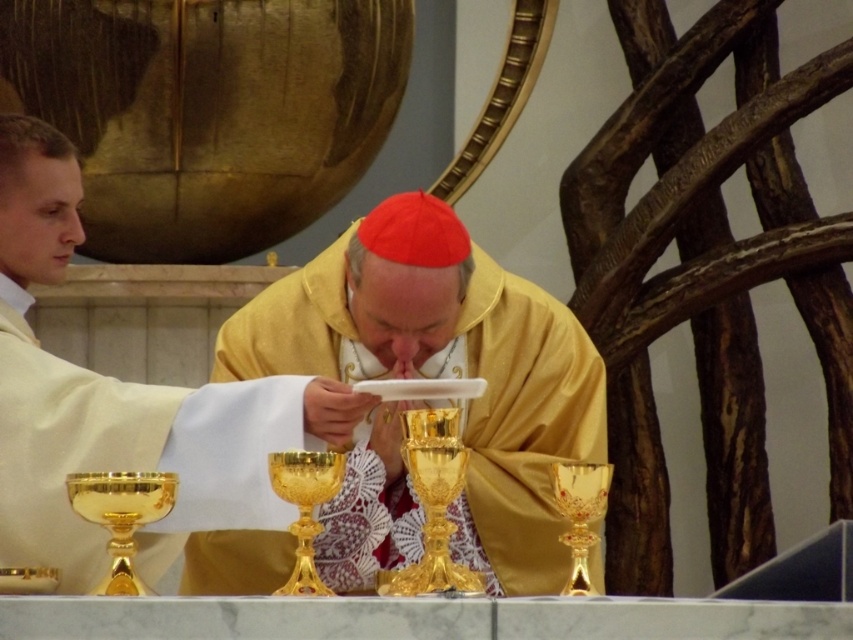
You are an attendee at this religious ceremony and want to know which robe is taller between the white matte robe at left and the gold satin robe at center. Can you tell me which one is taller?

The white matte robe at left is much taller than the gold satin robe at center.